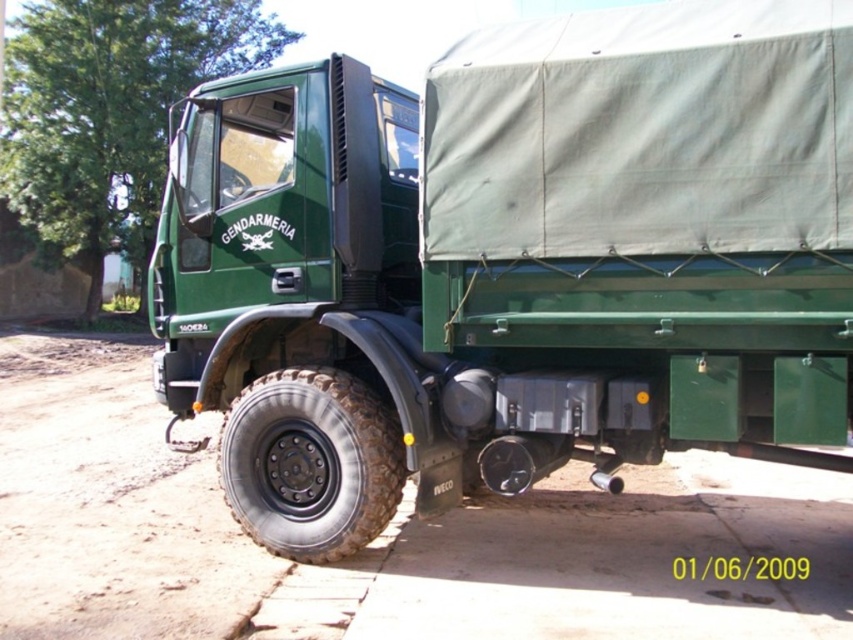
Who is more forward, (840, 81) or (276, 467)?

Point (840, 81) is more forward.

Where is `green matte truck at center`? This screenshot has height=640, width=853. green matte truck at center is located at coordinates coord(512,260).

Is point (836, 372) less distant than point (463, 556)?

Yes, it is.

Between point (548, 314) and point (503, 632), which one is positioned in front?

Point (503, 632) is more forward.

You are a GUI agent. You are given a task and a screenshot of the screen. Output one action in this format:
    pyautogui.click(x=<x>, y=<y>)
    Task: Click on the green matte truck at center
    The image size is (853, 640).
    Given the screenshot: What is the action you would take?
    pyautogui.click(x=512, y=260)

From the picture: Does brown dirt track at lower left appear on the right side of black rubber tire at lower left?

Incorrect, brown dirt track at lower left is not on the right side of black rubber tire at lower left.

Measure the distance between brown dirt track at lower left and camera.

brown dirt track at lower left is 3.88 meters away from camera.

You are a GUI agent. You are given a task and a screenshot of the screen. Output one action in this format:
    pyautogui.click(x=<x>, y=<y>)
    Task: Click on the brown dirt track at lower left
    This screenshot has height=640, width=853.
    Given the screenshot: What is the action you would take?
    pyautogui.click(x=379, y=536)